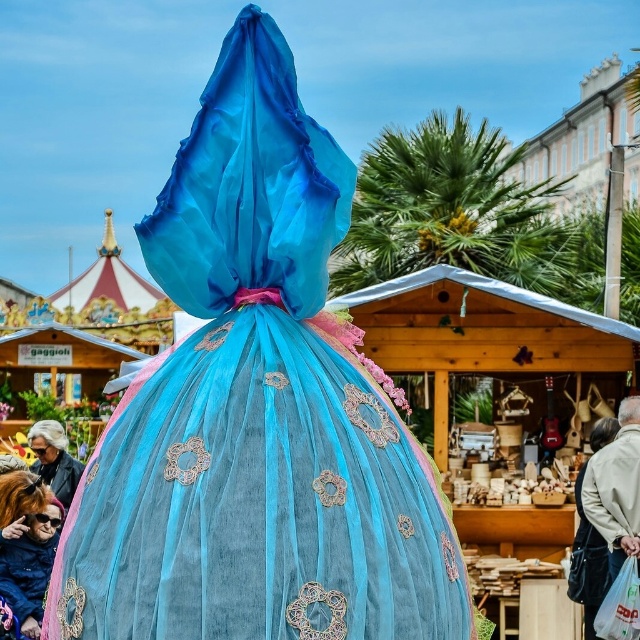
Which of these two, light beige fabric bag at lower right or matte black jacket at lower left, stands shorter?

matte black jacket at lower left

Who is more distant from viewer, (634, 484) or (68, 488)?

Positioned behind is point (68, 488).

Identify the location of light beige fabric bag at lower right. point(616,488).

Is point (12, 500) less distant than point (632, 497)?

Yes, it is in front of point (632, 497).

Does shiny blue fabric at center come in front of light beige fabric bag at lower right?

Yes, it is.

Where is `shiny blue fabric at center`? The height and width of the screenshot is (640, 640). shiny blue fabric at center is located at coordinates (26, 545).

Find the location of `shiny blue fabric at center`. shiny blue fabric at center is located at coordinates (26, 545).

Can you confirm if translucent tulle dress at center is positioned to the left of shiny blue fabric at center?

Incorrect, translucent tulle dress at center is not on the left side of shiny blue fabric at center.

Who is positioned more to the left, translucent tulle dress at center or shiny blue fabric at center?

From the viewer's perspective, shiny blue fabric at center appears more on the left side.

Is point (150, 481) closer to camera compared to point (48, 508)?

Yes, it is in front of point (48, 508).

Image resolution: width=640 pixels, height=640 pixels. I want to click on translucent tulle dress at center, so click(257, 412).